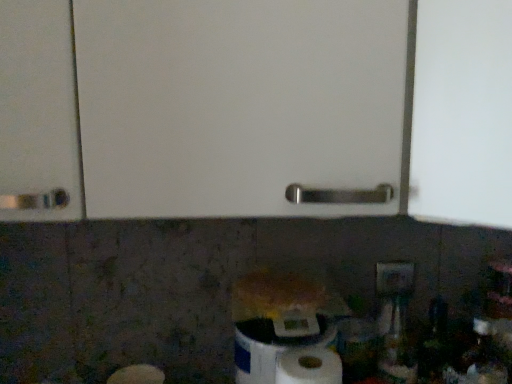
Question: Would you say white matte paper towel at lower center is part of white plastic electric outlet at lower right's contents?

Choices:
 (A) no
 (B) yes

Answer: (A)

Question: Is white plastic electric outlet at lower right facing towards white matte paper towel at lower center?

Choices:
 (A) no
 (B) yes

Answer: (A)

Question: Is white plastic electric outlet at lower right to the left of white matte paper towel at lower center from the viewer's perspective?

Choices:
 (A) yes
 (B) no

Answer: (B)

Question: Is white plastic electric outlet at lower right placed right next to white matte paper towel at lower center?

Choices:
 (A) no
 (B) yes

Answer: (A)

Question: Considering the relative sizes of white plastic electric outlet at lower right and white matte paper towel at lower center in the image provided, is white plastic electric outlet at lower right taller than white matte paper towel at lower center?

Choices:
 (A) no
 (B) yes

Answer: (A)

Question: From a real-world perspective, is white plastic electric outlet at lower right positioned under white matte paper towel at lower center based on gravity?

Choices:
 (A) no
 (B) yes

Answer: (A)

Question: Is white matte toilet paper at lower center at the back of white plastic electric outlet at lower right?

Choices:
 (A) no
 (B) yes

Answer: (A)

Question: Is white plastic electric outlet at lower right aimed at white matte toilet paper at lower center?

Choices:
 (A) yes
 (B) no

Answer: (B)

Question: Is white plastic electric outlet at lower right thinner than white matte toilet paper at lower center?

Choices:
 (A) yes
 (B) no

Answer: (A)

Question: Considering the relative sizes of white plastic electric outlet at lower right and white matte toilet paper at lower center in the image provided, is white plastic electric outlet at lower right wider than white matte toilet paper at lower center?

Choices:
 (A) no
 (B) yes

Answer: (A)

Question: Does white plastic electric outlet at lower right appear on the left side of white matte toilet paper at lower center?

Choices:
 (A) yes
 (B) no

Answer: (B)

Question: Is white plastic electric outlet at lower right smaller than white matte toilet paper at lower center?

Choices:
 (A) no
 (B) yes

Answer: (B)

Question: From the image's perspective, is white matte paper towel at lower center over white plastic electric outlet at lower right?

Choices:
 (A) yes
 (B) no

Answer: (B)